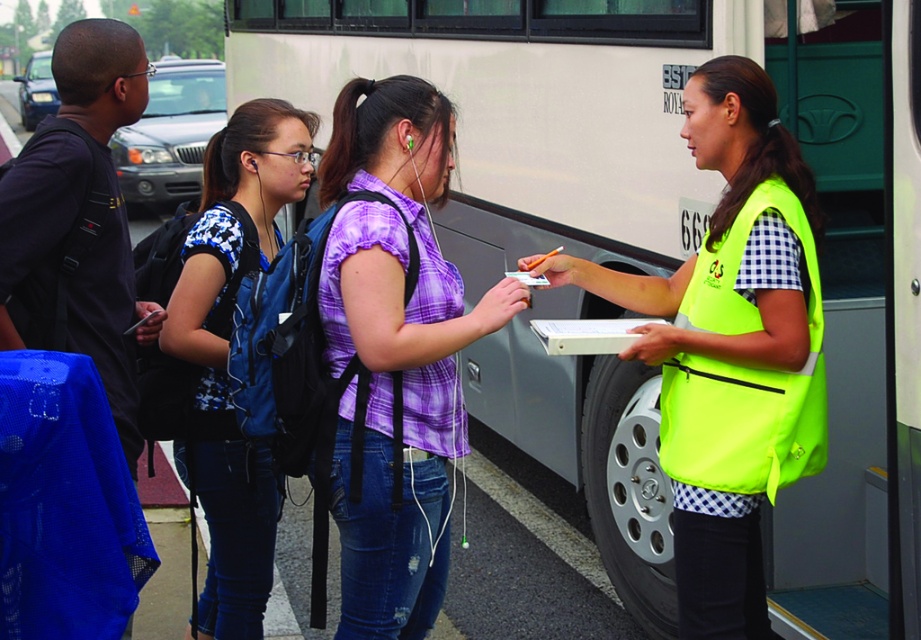
Question: Can you confirm if purple plaid shirt at center is positioned to the right of blue printed shirt at center?

Choices:
 (A) no
 (B) yes

Answer: (B)

Question: Which point is closer to the camera?

Choices:
 (A) purple plaid shirt at center
 (B) blue printed shirt at center
 (C) neon yellow fabric safety vest at right

Answer: (A)

Question: Does purple plaid shirt at center lie in front of blue printed shirt at center?

Choices:
 (A) yes
 (B) no

Answer: (A)

Question: Based on their relative distances, which object is nearer to the blue printed shirt at center?

Choices:
 (A) neon yellow fabric safety vest at right
 (B) neon yellow vest at center

Answer: (B)

Question: Which object appears farthest from the camera in this image?

Choices:
 (A) neon yellow fabric safety vest at right
 (B) blue printed shirt at center
 (C) neon yellow vest at center

Answer: (B)

Question: Can you confirm if neon yellow vest at center is positioned below neon yellow fabric safety vest at right?

Choices:
 (A) no
 (B) yes

Answer: (B)